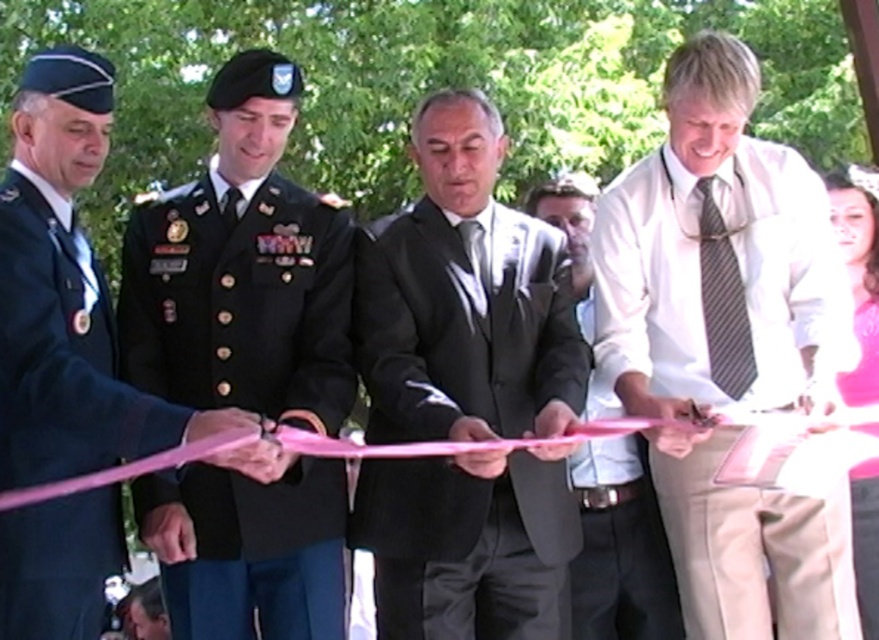
Based on the scene description, which object is located at the coordinates point (465, 298)?

The matte black suit at center is located at point (465, 298).

You are a photographer at the event and want to take a photo focusing on the dark green military uniform at center and the white shirt at center. Which one appears larger in the photo?

The dark green military uniform at center appears larger in the photo because it is closer to the viewer than the white shirt at center.

You are a photographer at the event and want to ensure both the matte black suit at center and the pink satin dress at lower right are clearly visible in the photo. Given their sizes, which one might require more space in the frame to capture fully?

The matte black suit at center has a larger size compared to the pink satin dress at lower right, so it would require more space in the frame to capture fully.